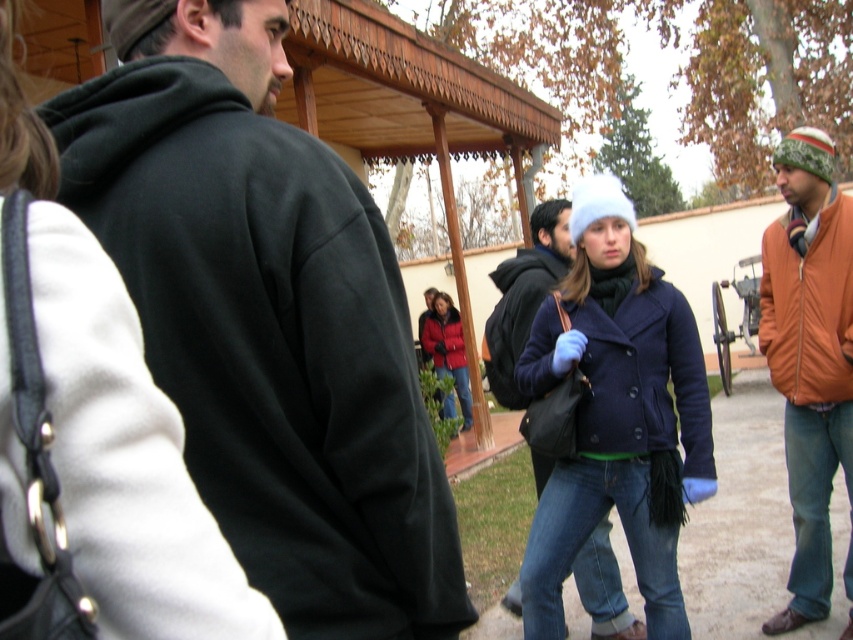
Question: Is dark green hoodie at center smaller than matte red coat at center?

Choices:
 (A) yes
 (B) no

Answer: (A)

Question: Is the position of orange nylon jacket at right less distant than that of orange fabric jacket at right?

Choices:
 (A) yes
 (B) no

Answer: (B)

Question: Which object appears closest to the camera in this image?

Choices:
 (A) dark green hoodie at center
 (B) orange fabric jacket at right

Answer: (A)

Question: Can you confirm if navy blue coat at center is positioned above matte red coat at center?

Choices:
 (A) no
 (B) yes

Answer: (B)

Question: Which point is farther to the camera?

Choices:
 (A) matte red jacket at center
 (B) orange nylon jacket at right
 (C) matte black jacket at center

Answer: (A)

Question: Which object is farther from the camera taking this photo?

Choices:
 (A) orange fabric jacket at right
 (B) navy blue coat at center
 (C) matte red jacket at center
 (D) matte black jacket at center

Answer: (C)